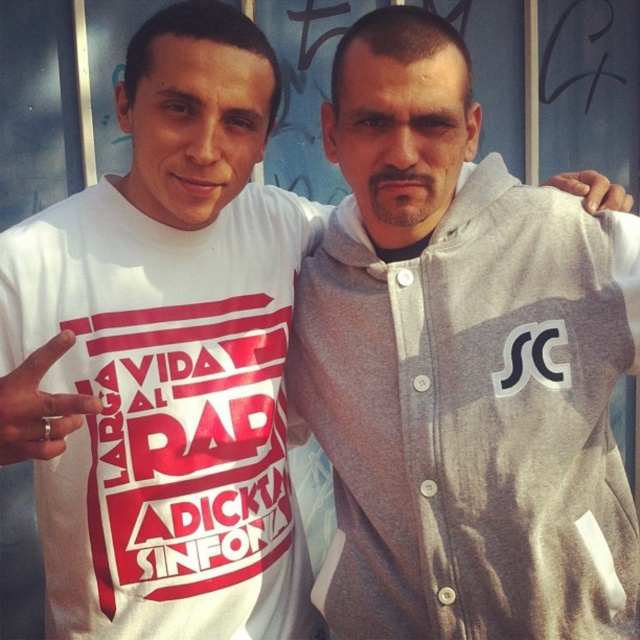
Question: Which point is closer to the camera?

Choices:
 (A) (467, 285)
 (B) (230, 358)

Answer: (A)

Question: Is gray fleece sweatshirt at center behind white matte t-shirt at left?

Choices:
 (A) no
 (B) yes

Answer: (B)

Question: Can you confirm if gray fleece sweatshirt at center is bigger than white matte t-shirt at left?

Choices:
 (A) no
 (B) yes

Answer: (B)

Question: Observing the image, what is the correct spatial positioning of gray fleece sweatshirt at center in reference to white matte t-shirt at left?

Choices:
 (A) below
 (B) above

Answer: (A)